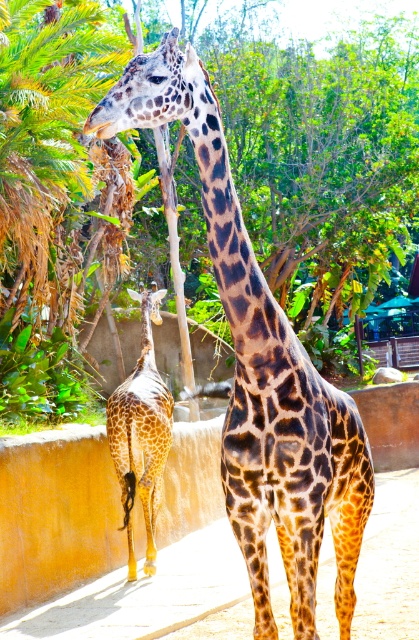
Does green leafy tree at upper left have a smaller size compared to spotted fur giraffe at lower left?

Incorrect, green leafy tree at upper left is not smaller in size than spotted fur giraffe at lower left.

Which of these two, green leafy tree at upper left or spotted fur giraffe at lower left, stands shorter?

Standing shorter between the two is spotted fur giraffe at lower left.

I want to click on green leafy tree at upper left, so click(323, 163).

Is green leafy tree at upper left above spotted fur giraffe at center?

Correct, green leafy tree at upper left is located above spotted fur giraffe at center.

At what (x,y) coordinates should I click in order to perform the action: click on green leafy tree at upper left. Please return your answer as a coordinate pair (x, y). The width and height of the screenshot is (419, 640). Looking at the image, I should click on (323, 163).

Image resolution: width=419 pixels, height=640 pixels. What are the coordinates of `green leafy tree at upper left` in the screenshot? It's located at (323, 163).

Is spotted fur giraffe at center smaller than spotted fur giraffe at lower left?

Incorrect, spotted fur giraffe at center is not smaller in size than spotted fur giraffe at lower left.

Between spotted fur giraffe at center and spotted fur giraffe at lower left, which one appears on the left side from the viewer's perspective?

Positioned to the left is spotted fur giraffe at lower left.

Does point (214, 97) come behind point (152, 557)?

That is False.

At what (x,y) coordinates should I click in order to perform the action: click on spotted fur giraffe at center. Please return your answer as a coordinate pair (x, y). Looking at the image, I should click on pyautogui.click(x=260, y=371).